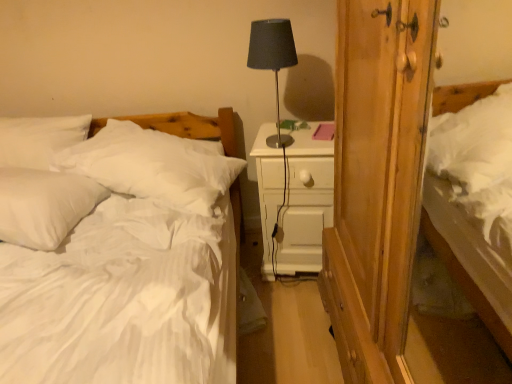
Where is `matte black lamp at center`? matte black lamp at center is located at coordinates (273, 60).

You are a GUI agent. You are given a task and a screenshot of the screen. Output one action in this format:
    pyautogui.click(x=<x>, y=<y>)
    Task: Click on the white soft bed at left
    The height and width of the screenshot is (384, 512).
    Given the screenshot: What is the action you would take?
    pyautogui.click(x=125, y=267)

Measure the distance between point (198, 338) and camera.

Point (198, 338) and camera are 3.53 feet apart.

This screenshot has height=384, width=512. In order to click on white wood nightstand at center in this screenshot , I will do `click(305, 203)`.

Locate an element on the screen. The height and width of the screenshot is (384, 512). matte black lamp at center is located at coordinates (273, 60).

Which object is further away from the camera taking this photo, matte black lamp at center or white soft bed at left?

matte black lamp at center is further from the camera.

Could you tell me if matte black lamp at center is facing white soft bed at left?

No, matte black lamp at center is not oriented towards white soft bed at left.

From the picture: Considering the relative positions of matte black lamp at center and white soft bed at left in the image provided, is matte black lamp at center to the left or to the right of white soft bed at left?

matte black lamp at center is positioned on white soft bed at left's right side.

Is white soft pillow at left, the 1th pillow from the left, bigger or smaller than white wood nightstand at center?

white soft pillow at left, the 1th pillow from the left, is smaller than white wood nightstand at center.

Is white soft pillow at left, the 1th pillow from the left, outside of white wood nightstand at center?

white soft pillow at left, the 1th pillow from the left, lies outside white wood nightstand at center's area.

Is white soft pillow at left, the 1th pillow from the left, placed right next to white wood nightstand at center?

No, white soft pillow at left, the 1th pillow from the left, is not next to white wood nightstand at center.

Consider the image. In terms of width, does matte black lamp at center look wider or thinner when compared to wooden wardrobe at right?

matte black lamp at center is thinner than wooden wardrobe at right.

How distant is matte black lamp at center from wooden wardrobe at right?

A distance of 67.45 centimeters exists between matte black lamp at center and wooden wardrobe at right.

From a real-world perspective, is matte black lamp at center beneath wooden wardrobe at right?

No, from a real-world perspective, matte black lamp at center is not under wooden wardrobe at right.

At what (x,y) coordinates should I click in order to perform the action: click on table lamp above the wooden wardrobe at right (from the image's perspective). Please return your answer as a coordinate pair (x, y). This screenshot has height=384, width=512. Looking at the image, I should click on (273, 60).

Is the position of white wood nightstand at center more distant than that of wooden wardrobe at right?

Yes, white wood nightstand at center is behind wooden wardrobe at right.

Find the location of a particular element. Image resolution: width=512 pixels, height=384 pixels. nightstand directly beneath the wooden wardrobe at right (from a real-world perspective) is located at coordinates (305, 203).

Considering the relative positions of white wood nightstand at center and wooden wardrobe at right in the image provided, is white wood nightstand at center to the left or to the right of wooden wardrobe at right?

From the image, it's evident that white wood nightstand at center is to the left of wooden wardrobe at right.

Are white wood nightstand at center and wooden wardrobe at right located far from each other?

No.

Is white soft bed at left inside wooden wardrobe at right?

Actually, white soft bed at left is outside wooden wardrobe at right.

From the picture: Which of these two, wooden wardrobe at right or white soft bed at left, stands taller?

With more height is wooden wardrobe at right.

Is wooden wardrobe at right next to white soft bed at left and touching it?

No, wooden wardrobe at right is not beside white soft bed at left.

Considering the sizes of wooden wardrobe at right and white soft bed at left in the image, is wooden wardrobe at right wider or thinner than white soft bed at left?

Clearly, wooden wardrobe at right has less width compared to white soft bed at left.

In the scene shown: From the image's perspective, which one is positioned higher, wooden wardrobe at right or white wood nightstand at center?

white wood nightstand at center.

From a real-world perspective, is wooden wardrobe at right under white wood nightstand at center?

No, from a real-world perspective, wooden wardrobe at right is not below white wood nightstand at center.

Does wooden wardrobe at right turn towards white wood nightstand at center?

No, wooden wardrobe at right does not turn towards white wood nightstand at center.

Who is taller, wooden wardrobe at right or white soft pillow at left, which is counted as the second pillow, starting from the left?

wooden wardrobe at right.

Between point (327, 304) and point (168, 157), which one is positioned in front?

The point (168, 157) is in front.

Is wooden wardrobe at right at the right side of white soft pillow at left, the 1th pillow from the right?

Correct, you'll find wooden wardrobe at right to the right of white soft pillow at left, the 1th pillow from the right.

Where is `armoire that is in front of the white soft pillow at left, which is counted as the second pillow, starting from the left`? The image size is (512, 384). armoire that is in front of the white soft pillow at left, which is counted as the second pillow, starting from the left is located at coordinates (377, 180).

In the image, there is a matte black lamp at center. Where is `bed below it (from a real-world perspective)`? The height and width of the screenshot is (384, 512). bed below it (from a real-world perspective) is located at coordinates (125, 267).

What are the coordinates of `the 2nd pillow counting from the left of the white wood nightstand at center` in the screenshot? It's located at (44, 205).

Looking at the image, which one is located further to white soft bed at left, white soft pillow at left, positioned as the 2th pillow in right-to-left order, or matte black lamp at center?

matte black lamp at center.

Estimate the real-world distances between objects in this image. Which object is further from white soft bed at left, wooden wardrobe at right or white soft pillow at left, the 1th pillow from the left?

wooden wardrobe at right is positioned further to the anchor white soft bed at left.

Based on the photo, considering their positions, is wooden wardrobe at right positioned further to white wood nightstand at center than white soft pillow at left, the 1th pillow from the right?

white soft pillow at left, the 1th pillow from the right, is positioned further to the anchor white wood nightstand at center.

Considering their positions, is white wood nightstand at center positioned further to white soft pillow at left, the 1th pillow from the left, than wooden wardrobe at right?

wooden wardrobe at right is positioned further to the anchor white soft pillow at left, the 1th pillow from the left.

When comparing their distances from matte black lamp at center, does white wood nightstand at center or white soft pillow at left, which is counted as the second pillow, starting from the left, seem further?

Based on the image, white soft pillow at left, which is counted as the second pillow, starting from the left, appears to be further to matte black lamp at center.

When comparing their distances from white soft pillow at left, the 1th pillow from the left, does white wood nightstand at center or white soft pillow at left, the 1th pillow from the right, seem further?

The object further to white soft pillow at left, the 1th pillow from the left, is white wood nightstand at center.

From the image, which object appears to be nearer to white wood nightstand at center, matte black lamp at center or white soft pillow at left, which is counted as the second pillow, starting from the left?

white soft pillow at left, which is counted as the second pillow, starting from the left, is positioned closer to the anchor white wood nightstand at center.

Based on their spatial positions, is white soft pillow at left, the 1th pillow from the right, or wooden wardrobe at right closer to white wood nightstand at center?

wooden wardrobe at right is closer to white wood nightstand at center.

The image size is (512, 384). In order to click on table lamp between white soft pillow at left, the 1th pillow from the left, and white wood nightstand at center, in the horizontal direction in this screenshot , I will do `click(273, 60)`.

The height and width of the screenshot is (384, 512). I want to click on pillow between white soft pillow at left, the 1th pillow from the left, and white wood nightstand at center, so click(153, 166).

Locate an element on the screen. table lamp positioned between white soft bed at left and white wood nightstand at center from near to far is located at coordinates (273, 60).

Where is `pillow between white soft pillow at left, positioned as the 2th pillow in right-to-left order, and wooden wardrobe at right from left to right`? This screenshot has height=384, width=512. pillow between white soft pillow at left, positioned as the 2th pillow in right-to-left order, and wooden wardrobe at right from left to right is located at coordinates (153, 166).